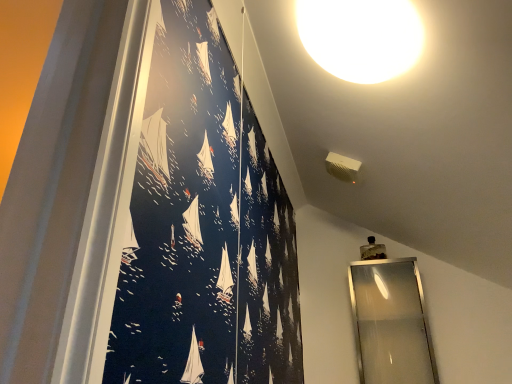
Where is `silver metallic mirror at right`? This screenshot has height=384, width=512. silver metallic mirror at right is located at coordinates (391, 323).

This screenshot has width=512, height=384. What do you see at coordinates (391, 323) in the screenshot?
I see `silver metallic mirror at right` at bounding box center [391, 323].

What do you see at coordinates (361, 37) in the screenshot? I see `white glossy light fixture at upper center` at bounding box center [361, 37].

Identify the location of white glossy light fixture at upper center. The image size is (512, 384). (361, 37).

This screenshot has height=384, width=512. Identify the location of silver metallic mirror at right. (391, 323).

Considering the relative positions of white glossy light fixture at upper center and silver metallic mirror at right in the image provided, is white glossy light fixture at upper center to the right of silver metallic mirror at right from the viewer's perspective?

Incorrect, white glossy light fixture at upper center is not on the right side of silver metallic mirror at right.

In the image, is white glossy light fixture at upper center positioned in front of or behind silver metallic mirror at right?

white glossy light fixture at upper center is positioned closer to the viewer than silver metallic mirror at right.

Is point (334, 37) closer to viewer compared to point (349, 274)?

That is True.

From the image's perspective, which one is positioned higher, white glossy light fixture at upper center or silver metallic mirror at right?

white glossy light fixture at upper center, from the image's perspective.

Consider the image. From a real-world perspective, does white glossy light fixture at upper center stand above silver metallic mirror at right?

Yes.

Can you confirm if white glossy light fixture at upper center is wider than silver metallic mirror at right?

Correct, the width of white glossy light fixture at upper center exceeds that of silver metallic mirror at right.

Considering the relative sizes of white glossy light fixture at upper center and silver metallic mirror at right in the image provided, is white glossy light fixture at upper center taller than silver metallic mirror at right?

Incorrect, the height of white glossy light fixture at upper center is not larger of that of silver metallic mirror at right.

Looking at the image, does white glossy light fixture at upper center seem bigger or smaller compared to silver metallic mirror at right?

Clearly, white glossy light fixture at upper center is smaller in size than silver metallic mirror at right.

Can we say white glossy light fixture at upper center lies outside silver metallic mirror at right?

Indeed, white glossy light fixture at upper center is completely outside silver metallic mirror at right.

Is white glossy light fixture at upper center placed right next to silver metallic mirror at right?

white glossy light fixture at upper center and silver metallic mirror at right are not in contact.

Is silver metallic mirror at right at the back of white glossy light fixture at upper center?

white glossy light fixture at upper center does not have its back to silver metallic mirror at right.

How different are the orientations of white glossy light fixture at upper center and silver metallic mirror at right in degrees?

The angular difference between white glossy light fixture at upper center and silver metallic mirror at right is 88.8 degrees.

Identify the location of mirror behind the white glossy light fixture at upper center. (391, 323).

Can you confirm if silver metallic mirror at right is positioned to the right of white glossy light fixture at upper center?

Yes.

Relative to white glossy light fixture at upper center, is silver metallic mirror at right in front or behind?

Clearly, silver metallic mirror at right is behind white glossy light fixture at upper center.

Which is closer, (418, 300) or (397, 15)?

The point (397, 15) is in front.

From the image's perspective, between silver metallic mirror at right and white glossy light fixture at upper center, who is located below?

silver metallic mirror at right is shown below in the image.

From a real-world perspective, is silver metallic mirror at right located beneath white glossy light fixture at upper center?

Yes, from a real-world perspective, silver metallic mirror at right is below white glossy light fixture at upper center.

Is silver metallic mirror at right wider than white glossy light fixture at upper center?

Incorrect, the width of silver metallic mirror at right does not surpass that of white glossy light fixture at upper center.

Does silver metallic mirror at right have a greater height compared to white glossy light fixture at upper center?

Yes.

Is silver metallic mirror at right smaller than white glossy light fixture at upper center?

Actually, silver metallic mirror at right might be larger than white glossy light fixture at upper center.

Is silver metallic mirror at right inside the boundaries of white glossy light fixture at upper center, or outside?

silver metallic mirror at right is not inside white glossy light fixture at upper center, it's outside.

In the scene shown: Are silver metallic mirror at right and white glossy light fixture at upper center located far from each other?

Indeed, silver metallic mirror at right is not near white glossy light fixture at upper center.

Is silver metallic mirror at right looking in the opposite direction of white glossy light fixture at upper center?

That's not correct — silver metallic mirror at right is not looking away from white glossy light fixture at upper center.

You are a GUI agent. You are given a task and a screenshot of the screen. Output one action in this format:
    pyautogui.click(x=<x>, y=<y>)
    Task: Click on the lamp above the silver metallic mirror at right (from the image's perspective)
    This screenshot has width=512, height=384.
    Given the screenshot: What is the action you would take?
    pyautogui.click(x=361, y=37)

Locate an element on the screen. Image resolution: width=512 pixels, height=384 pixels. lamp on the left of silver metallic mirror at right is located at coordinates (361, 37).

In order to click on mirror located below the white glossy light fixture at upper center (from the image's perspective) in this screenshot , I will do `click(391, 323)`.